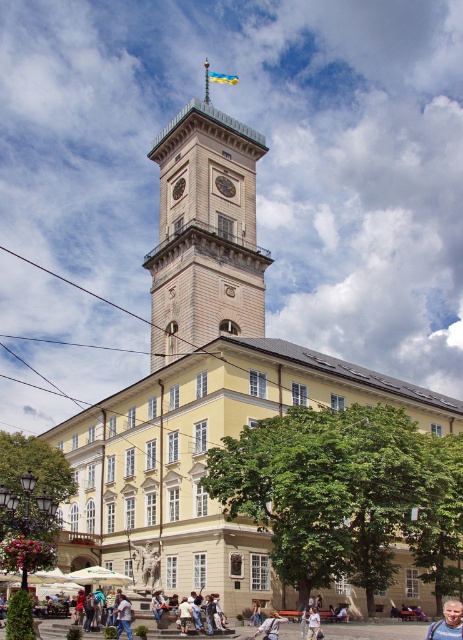
Question: Is light blue fabric shirt at lower right above light blue denim jeans at lower center?

Choices:
 (A) yes
 (B) no

Answer: (B)

Question: Which is nearer to the golden polished clock at center?

Choices:
 (A) goldmetallicclock at center
 (B) white cotton shirt at center
 (C) blue jeans at lower center
 (D) light brown stone clock tower at center

Answer: (A)

Question: Which point is closer to the camera taking this photo?

Choices:
 (A) (232, 195)
 (B) (235, 241)
 (C) (129, 616)

Answer: (C)

Question: Among these objects, which one is nearest to the camera?

Choices:
 (A) white cotton shirt at center
 (B) blue jeans at lower center
 (C) golden polished clock at center

Answer: (A)

Question: Where is light brown stone clock tower at center located in relation to light blue fabric shirt at lower right in the image?

Choices:
 (A) right
 (B) left

Answer: (B)

Question: Does light blue denim jeans at lower center appear on the right side of goldmetallicclock at center?

Choices:
 (A) yes
 (B) no

Answer: (A)